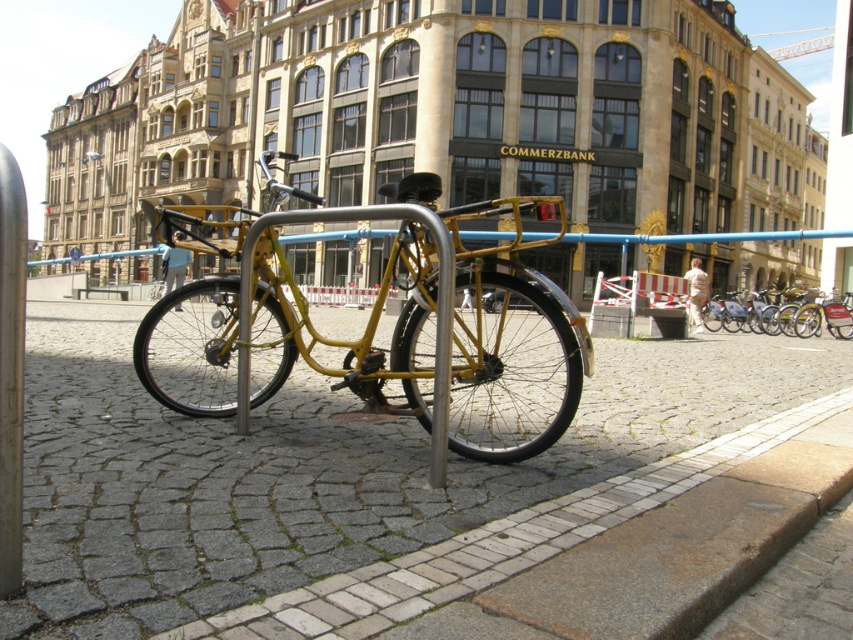
Question: Considering the real-world distances, which object is closest to the smooth cobblestone pavement at center?

Choices:
 (A) matte yellow bicycle at center
 (B) yellow matte bicycle at center

Answer: (B)

Question: Is smooth cobblestone pavement at center positioned in front of matte yellow bicycle at center?

Choices:
 (A) yes
 (B) no

Answer: (A)

Question: Does smooth cobblestone pavement at center lie behind yellow matte bicycle at center?

Choices:
 (A) no
 (B) yes

Answer: (A)

Question: Which of the following is the farthest from the observer?

Choices:
 (A) (846, 310)
 (B) (415, 396)

Answer: (A)

Question: In this image, where is yellow matte bicycle at center located relative to matte yellow bicycle at center?

Choices:
 (A) right
 (B) left

Answer: (B)

Question: Which point is closer to the camera?

Choices:
 (A) (769, 312)
 (B) (543, 368)
 (C) (138, 600)

Answer: (C)